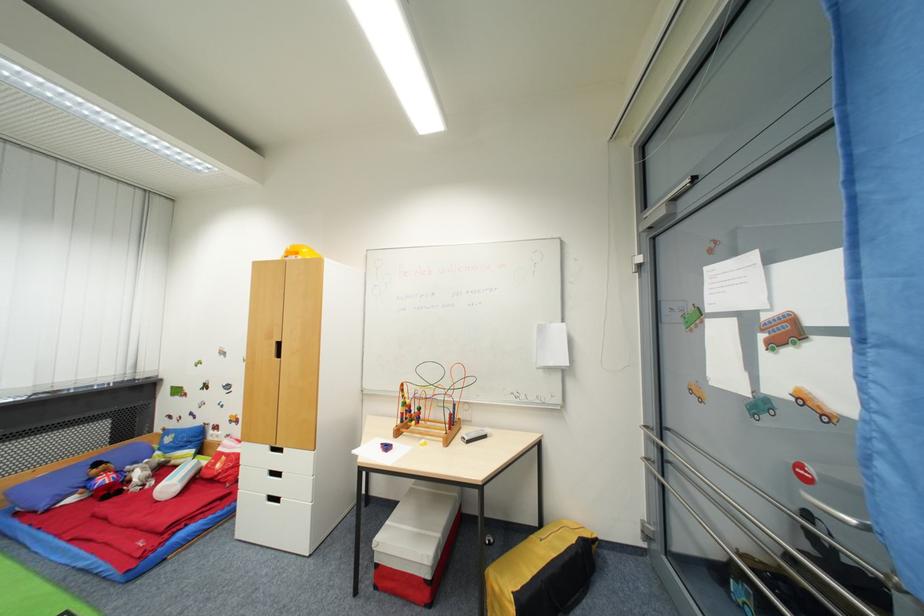
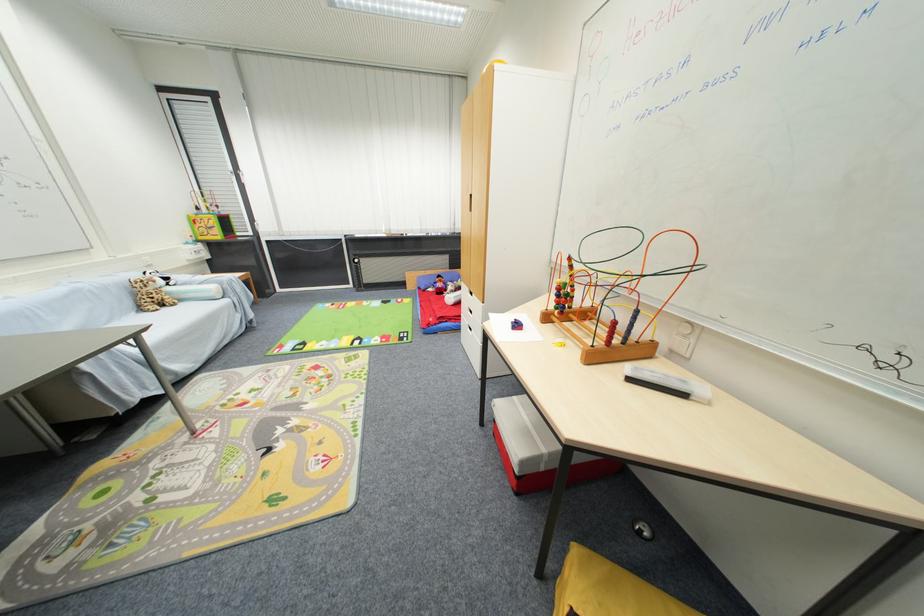
The point at (407,387) is marked in the first image. Where is the corresponding point in the second image?

(575, 261)